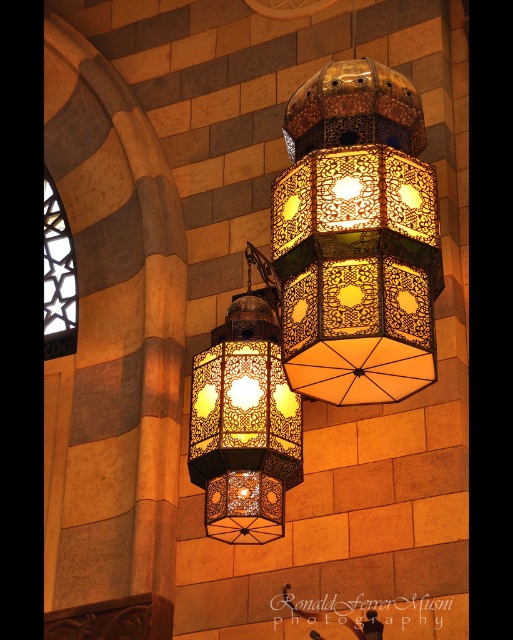
You are an interior designer planning to hang two lanterns in a narrow hallway. You have the golden metallic lantern at center and the matte metal lantern at center. Considering the hallway width, which lantern would be more suitable to avoid blocking the passage?

The matte metal lantern at center is more suitable because the golden metallic lantern at center is wider, so choosing the narrower one would prevent blocking the hallway passage.

You are an interior designer planning to install two lanterns in a similar historical building. You have the golden metallic lantern at center and the matte metal lantern at center. Which lantern should you choose if you want the one that is bigger in size?

The golden metallic lantern at center is larger in size than the matte metal lantern at center, so you should choose the golden metallic lantern at center if you want the bigger one.